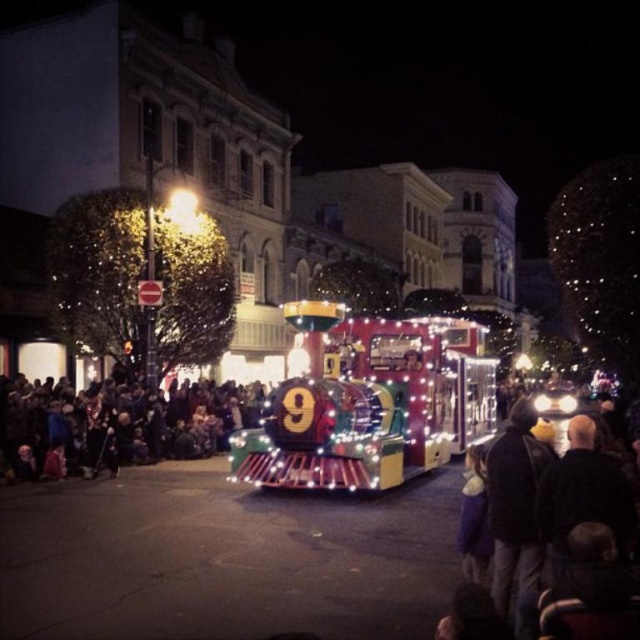
You are a photographer trying to capture the festive train at the center of the scene. There is a person with dark brown hair at center in the way. Can you estimate the direction you need to move to avoid blocking the train?

The dark brown hair at center is located at point 0.666 on the x axis and 0.178 on the y axis. To avoid blocking the train, move either to the left or right along the x axis away from the center position.

You are a photographer taking a picture of the festive train. You notice a person with dark brown hair at center and a dark gray hoodie at center in your shot. Which object is more to the left in the image?

The dark brown hair at center is positioned on the left side of dark gray hoodie at center, so the dark brown hair at center is more to the left.

Based on the photo, in the festive nighttime scene with the illuminated train, you notice a person with dark brown hair at center and a dark blue jacket at center. Which object is located more to the left?

The dark brown hair at center is positioned on the left side of dark blue jacket at center.